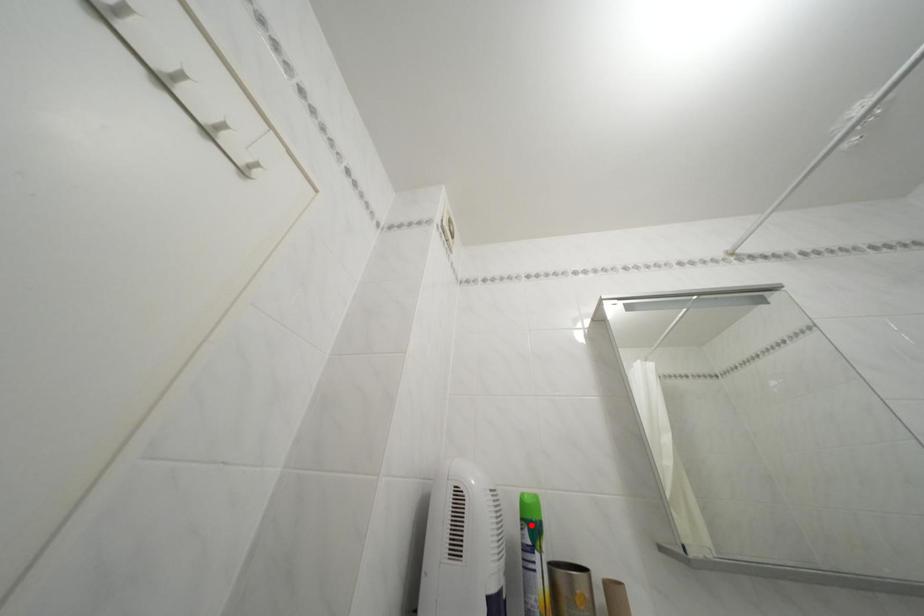
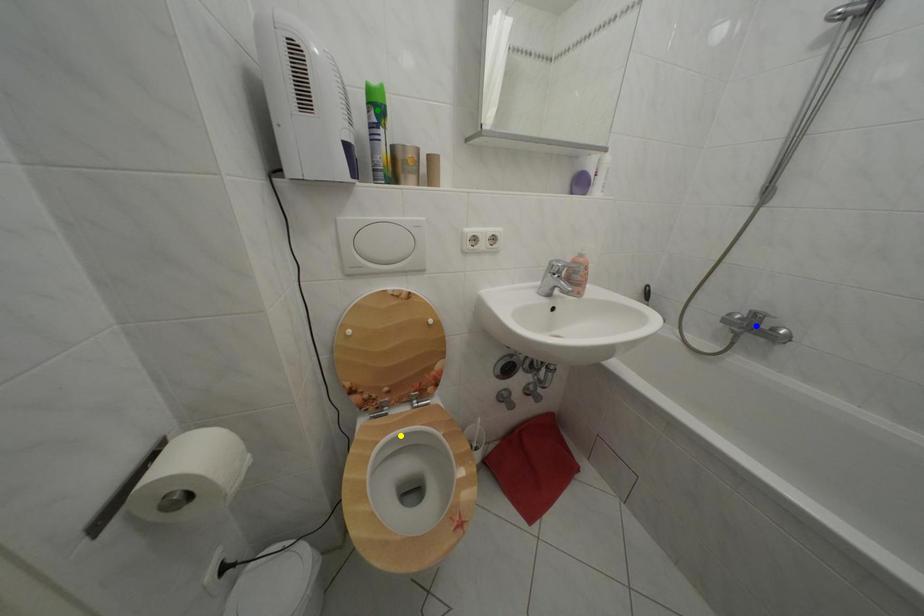
Question: I am providing you with two images of the same scene from different viewpoints. A red point is marked on the first image. You are given multiple points on the second image. In image 2, which mark is for the same physical point as the one in image 1?

Choices:
 (A) blue point
 (B) yellow point
 (C) green point

Answer: (C)